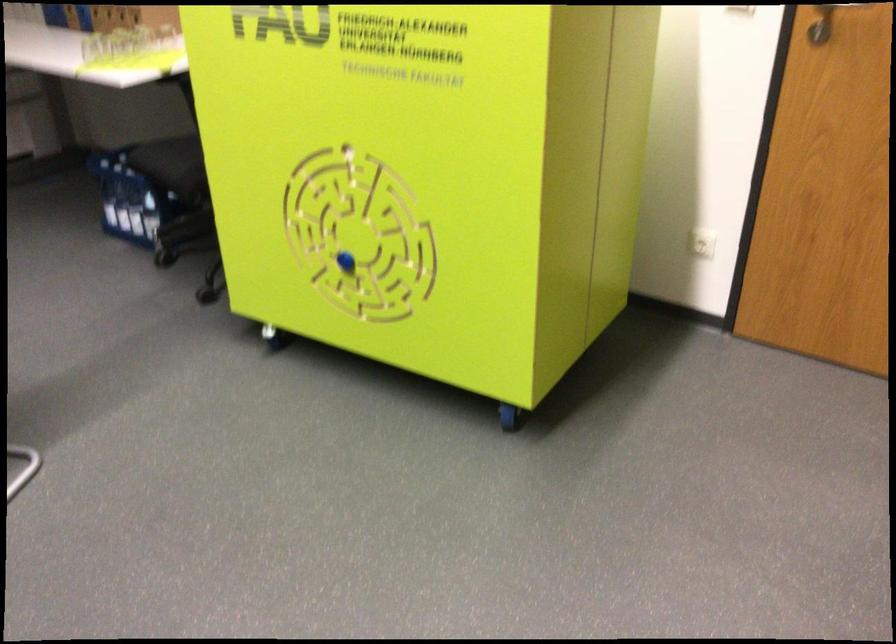
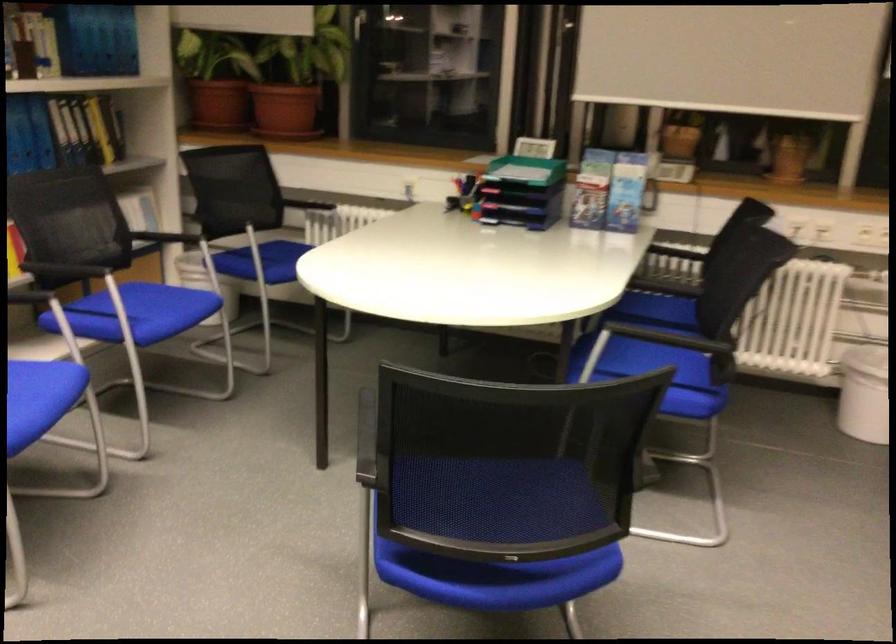
Question: The camera is either moving clockwise (left) or counter-clockwise (right) around the object. The first image is from the beginning of the video and the second image is from the end. Is the camera moving left or right when shooting the video?

Choices:
 (A) Left
 (B) Right

Answer: (B)